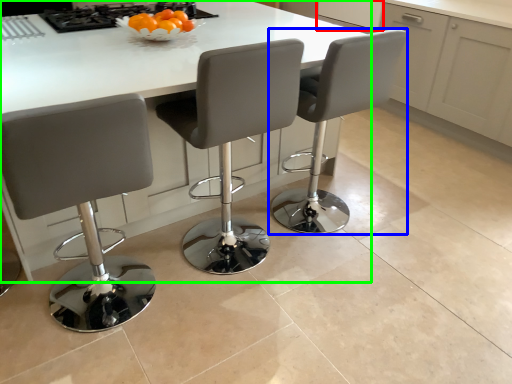
Question: Which object is positioned farthest from cabinetry (highlighted by a red box)? Select from chair (highlighted by a blue box) and kitchen & dining room table (highlighted by a green box).

Choices:
 (A) chair
 (B) kitchen & dining room table

Answer: (B)